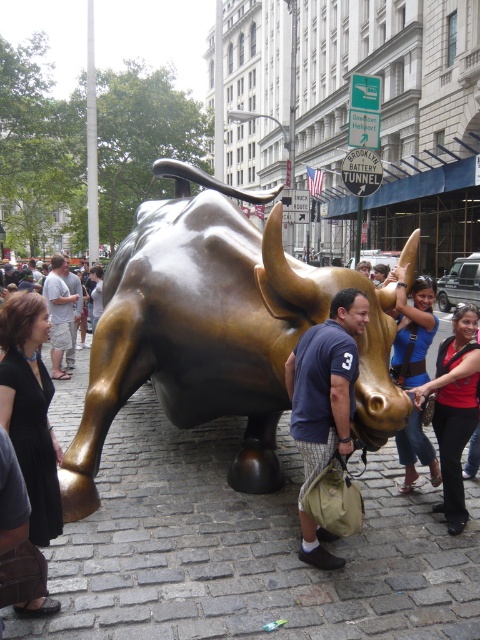
What do you see at coordinates (216, 332) in the screenshot? The height and width of the screenshot is (640, 480). I see `gold polished metal bull at center` at bounding box center [216, 332].

Looking at this image, is gold polished metal bull at center positioned behind matte gold statue at center?

No, it is not.

Who is more forward, (151, 364) or (55, 278)?

Point (151, 364)

The height and width of the screenshot is (640, 480). Identify the location of gold polished metal bull at center. (216, 332).

Can you confirm if gold polished metal bull at center is thinner than red fabric shirt at center?

No.

Is gold polished metal bull at center smaller than red fabric shirt at center?

Actually, gold polished metal bull at center might be larger than red fabric shirt at center.

The width and height of the screenshot is (480, 640). What do you see at coordinates (216, 332) in the screenshot?
I see `gold polished metal bull at center` at bounding box center [216, 332].

The width and height of the screenshot is (480, 640). What are the coordinates of `gold polished metal bull at center` in the screenshot? It's located at (216, 332).

Which is in front, point (406, 336) or point (62, 314)?

Point (406, 336)

Between point (406, 449) and point (62, 259), which one is positioned behind?

The point (62, 259) is more distant.

Image resolution: width=480 pixels, height=640 pixels. I want to click on blue fabric shirt at center, so click(x=411, y=328).